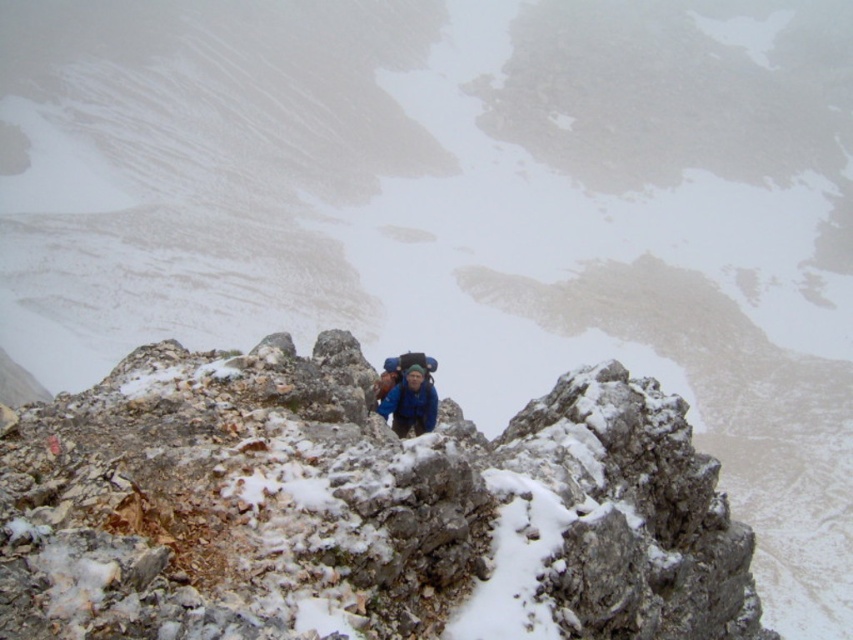
You are a photographer planning to capture a wide shot of the mountain landscape. You want to ensure both the gray rough rock at center and the blue fabric jacket at center are clearly visible in the frame. Which object should you focus on first to ensure depth of field captures both effectively?

The gray rough rock at center is bigger than the blue fabric jacket at center, so focusing on the larger object first will help ensure both are in focus within the depth of field.

You are a hiker trying to navigate the mountain path. You see the gray rough rock at center. Based on its 2D coordinates, is it closer to the top or bottom of the image?

The gray rough rock at center is located at coordinates 0.798 in the x and 0.422 in the y. Since the y coordinate is closer to 0.5, it is near the center vertically, so it is neither closer to the top nor the bottom of the image.

You are navigating a mountain path and see two points marked on your map. The first point is at coordinates point (547, 545) and the second is at point (415, 388). Which point is closer to your current position if you are standing at the base of the mountain?

Point (547, 545) is in front of point (415, 388), so it is closer to your current position at the base of the mountain.